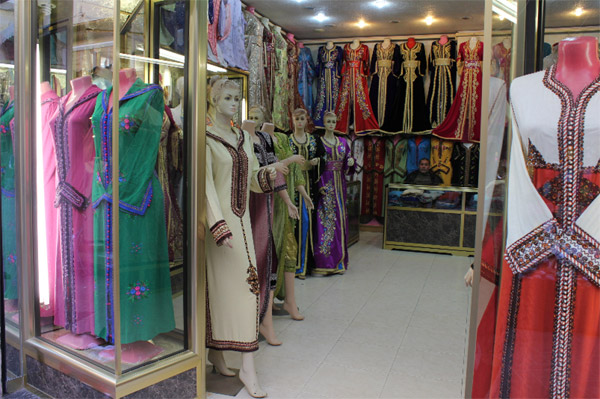
Locate an element on the screen. overhead lights that are powered on is located at coordinates (321, 17), (296, 0), (360, 22), (381, 2), (428, 19), (501, 17), (578, 10).